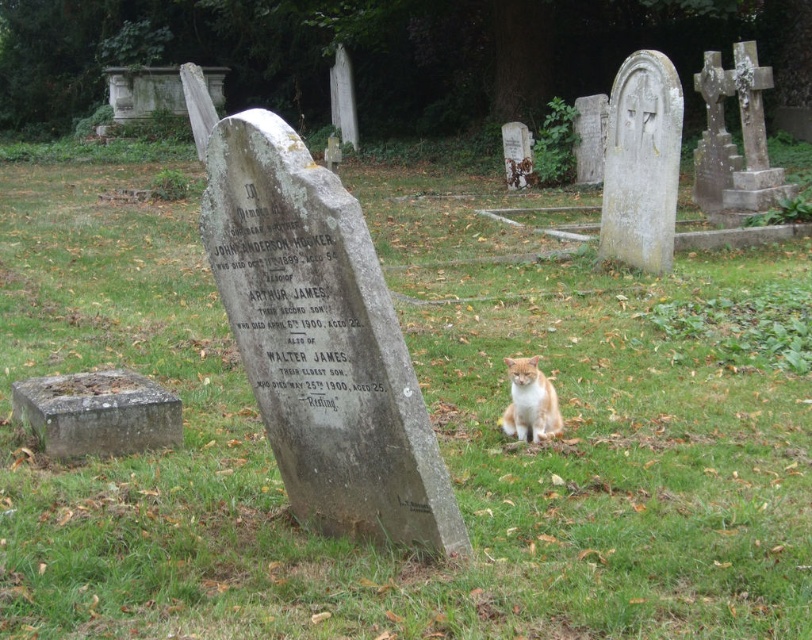
You are standing at the center of the image and want to place a new memorial plaque exactly at the same position as the gray stone at lower left. What are the coordinates where you should place it?

The gray stone at lower left is located at coordinates point (x=97, y=413), so you should place the new memorial plaque at point (x=97, y=413).

Consider the image. You are a photographer wanting to capture both the gray stone at lower left and the orange fur cat at center in a single frame. Given their sizes, which object should you focus on first to ensure both are in the frame?

The gray stone at lower left is bigger than the orange fur cat at center, so you should focus on the gray stone at lower left first to ensure both are in the frame.